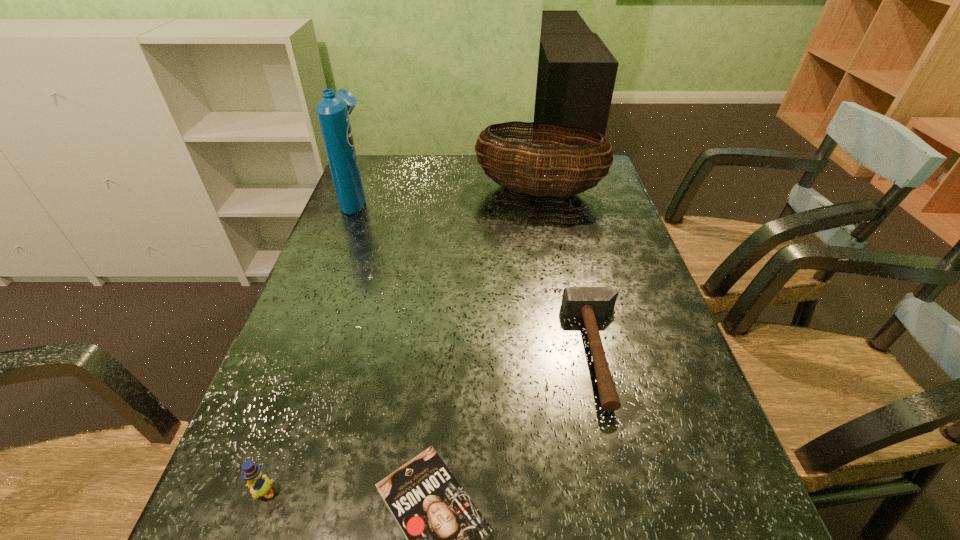
Where is `the tallest object`? The width and height of the screenshot is (960, 540). the tallest object is located at coordinates (333, 110).

Locate an element on the screen. This screenshot has height=540, width=960. basket is located at coordinates (499, 157).

Image resolution: width=960 pixels, height=540 pixels. Find the location of `duckling`. duckling is located at coordinates (259, 485).

Find the location of `the third farthest object`. the third farthest object is located at coordinates (588, 302).

The width and height of the screenshot is (960, 540). I want to click on the fourth tallest object, so click(x=588, y=302).

Find the location of `vacant space located on the right of the tallest object`. vacant space located on the right of the tallest object is located at coordinates (446, 198).

Identify the location of vacant space located 0.310m on the left of the fourth shortest object. (376, 190).

At what (x,y) coordinates should I click in order to perform the action: click on free location located on the striking surface of the third farthest object. Please return your answer as a coordinate pair (x, y). This screenshot has height=540, width=960. Looking at the image, I should click on (474, 352).

You are a GUI agent. You are given a task and a screenshot of the screen. Output one action in this format:
    pyautogui.click(x=<x>, y=<y>)
    Task: Click on the blank space located 0.350m on the striking surface of the third farthest object
    This screenshot has width=960, height=540.
    Given the screenshot: What is the action you would take?
    pyautogui.click(x=402, y=352)

You are a GUI agent. You are given a task and a screenshot of the screen. Output one action in this format:
    pyautogui.click(x=<x>, y=<y>)
    Task: Click on the vacant space located on the striking surface of the third farthest object
    
    Given the screenshot: What is the action you would take?
    pyautogui.click(x=522, y=352)